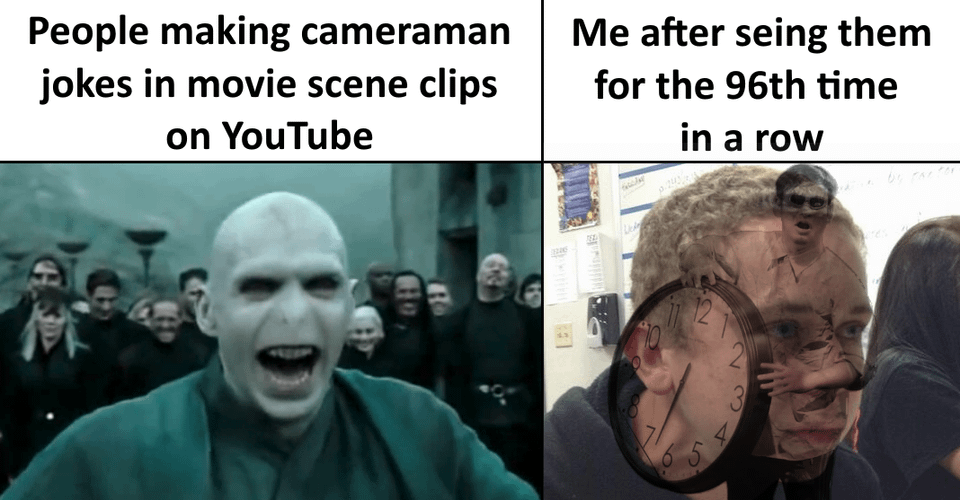
Locate an element on the screen. light switch is located at coordinates (561, 328).